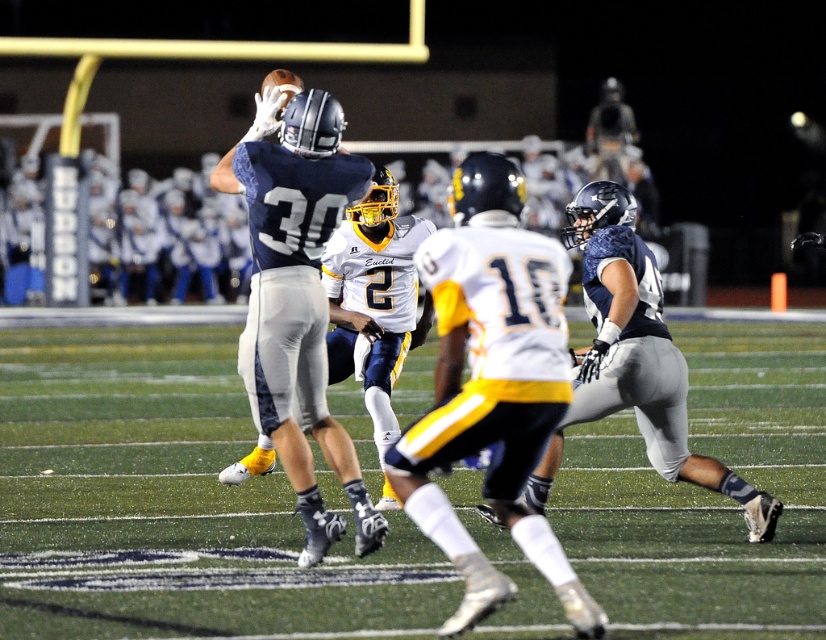
Question: Is green turf at center thinner than matte blue helmet at center?

Choices:
 (A) yes
 (B) no

Answer: (B)

Question: Is matte blue helmet at center closer to camera compared to matte blue jersey at center?

Choices:
 (A) yes
 (B) no

Answer: (A)

Question: Among these points, which one is nearest to the camera?

Choices:
 (A) (257, 131)
 (B) (491, 166)

Answer: (B)

Question: Which point appears farthest from the camera in this image?

Choices:
 (A) (152, 419)
 (B) (501, 369)
 (C) (282, 419)

Answer: (A)

Question: Does green turf at center appear on the right side of white jersey at center?

Choices:
 (A) no
 (B) yes

Answer: (B)

Question: Which is farther from the green turf at center?

Choices:
 (A) matte blue jersey at center
 (B) white jersey at center
 (C) matte blue helmet at center

Answer: (B)